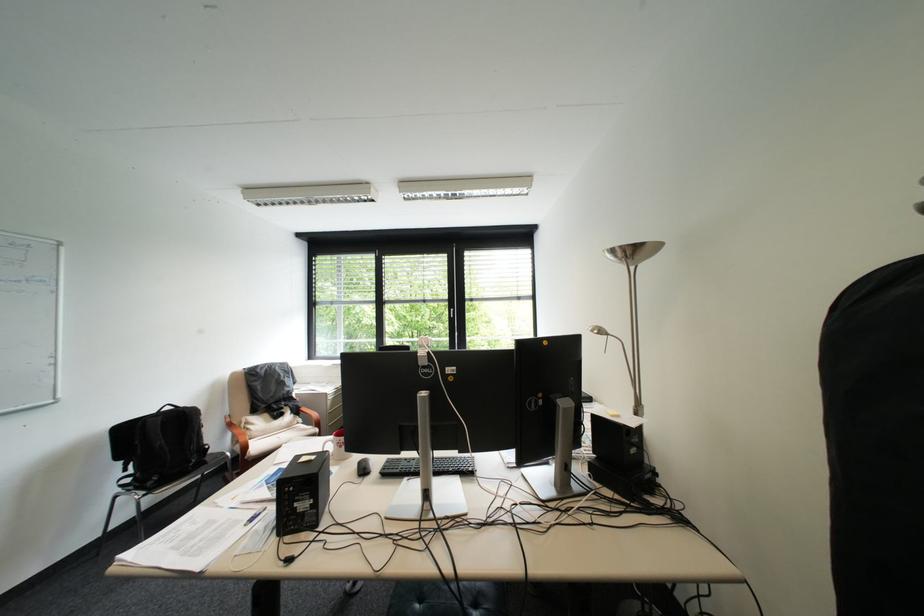
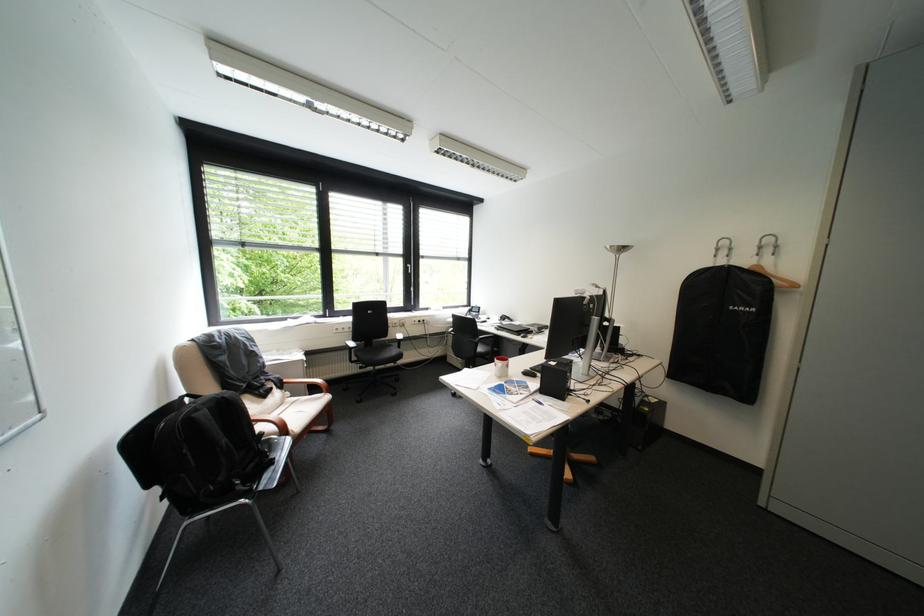
Find the pixel in the second image that matches pixel 311 408 in the first image.

(294, 381)